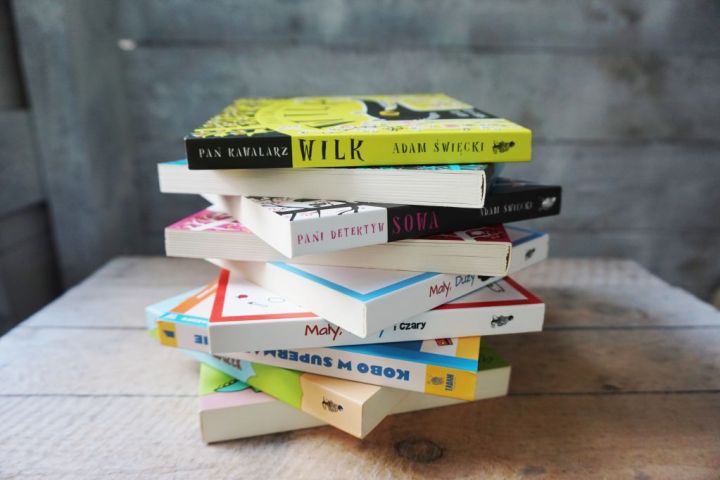
Locate an element on the screen. This screenshot has height=480, width=720. books is located at coordinates point(238,422), point(338,405), point(386,365), point(443,327), point(386,311), point(392,256), point(358,232), point(354,181), point(354,133).